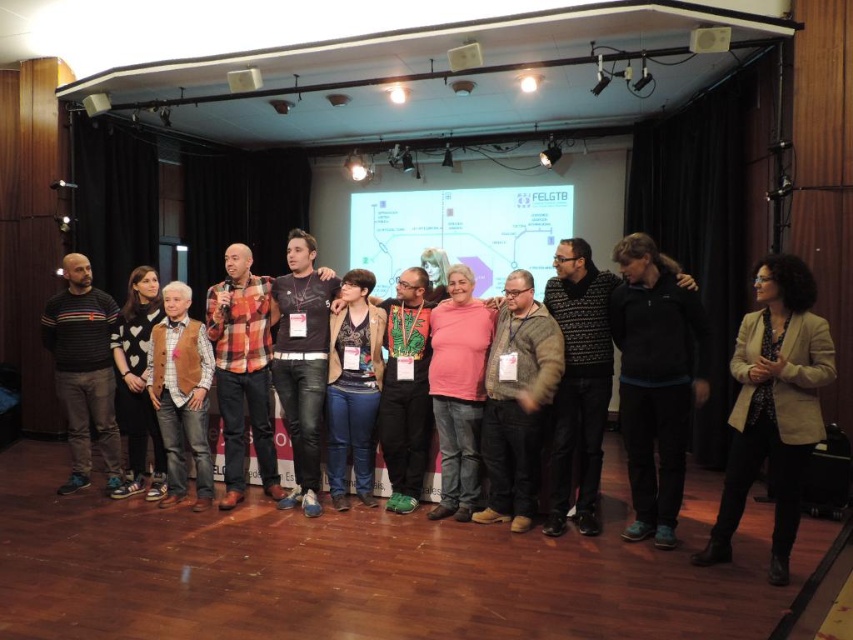
Question: Is striped sweater at left smaller than blue jeans at center?

Choices:
 (A) yes
 (B) no

Answer: (B)

Question: Considering the relative positions of blue jeans at center and white sweater at left in the image provided, where is blue jeans at center located with respect to white sweater at left?

Choices:
 (A) left
 (B) right

Answer: (B)

Question: Which point is closer to the camera?

Choices:
 (A) (670, 394)
 (B) (527, 252)
 (C) (370, 312)
 (D) (126, 486)

Answer: (A)

Question: Which of the following is the closest to the observer?

Choices:
 (A) white matte projection screen at center
 (B) blue jeans at center
 (C) black fleece jacket at center

Answer: (C)

Question: Does black fleece jacket at center appear over pink matte sweater at center?

Choices:
 (A) no
 (B) yes

Answer: (B)

Question: Which is nearer to the beige fabric blazer at center?

Choices:
 (A) striped sweater at left
 (B) knitted sweater at center

Answer: (B)